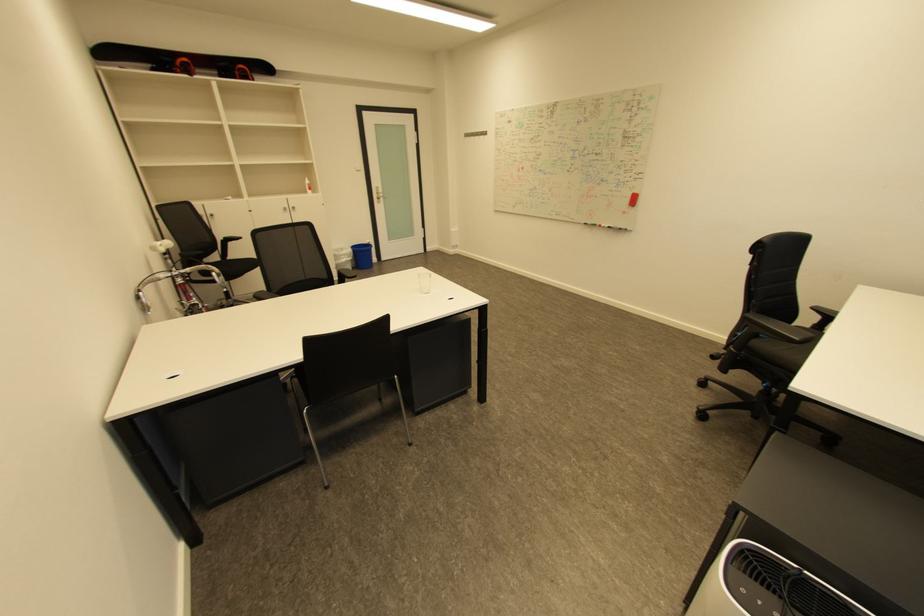
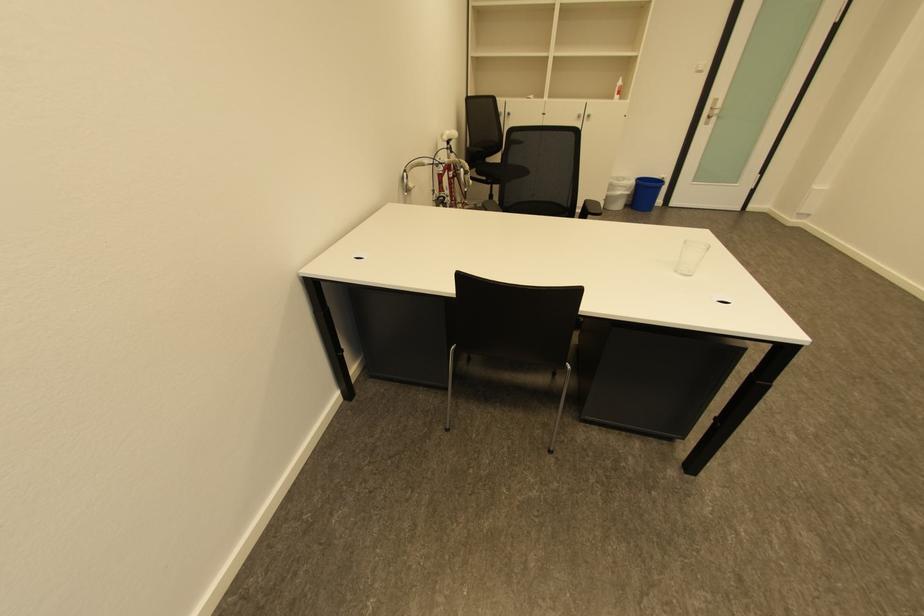
Locate, in the second image, the point that corresponds to (293,209) in the first image.

(585, 118)